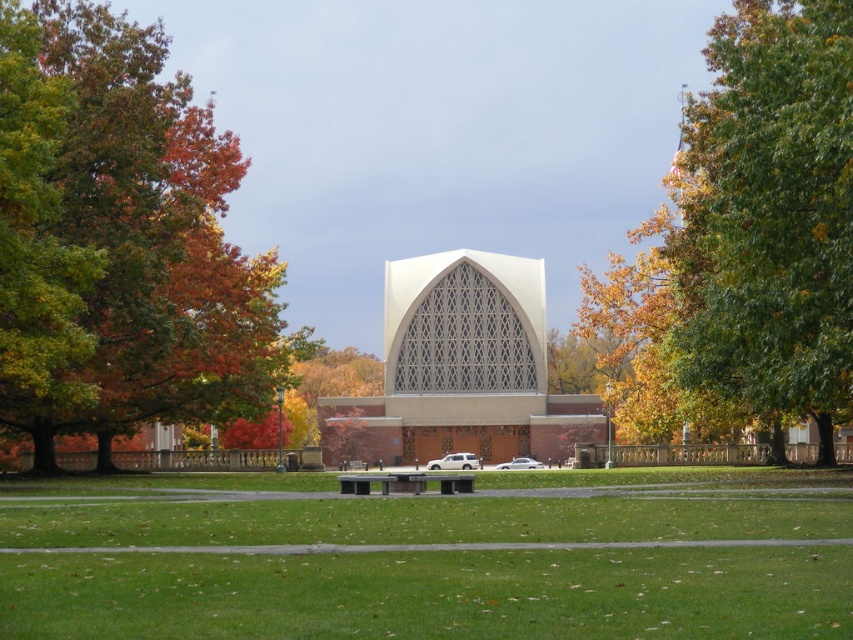
You are standing at the entrance of the building and want to walk to the green grass at center. According to the coordinates provided, in which direction should you move relative to the building?

The green grass at center is located at coordinates point (431, 557). Since the coordinates are given as x,y where higher x values move right and higher y values move up, moving towards the right and slightly upwards from the building would lead you to the green grass at center.

You are standing at the entrance of the building and want to walk towards the point marked as point (636,492). Which direction should you walk relative to the point marked as point (456,454)?

You should walk towards the point (636,492), which is in front of the point (456,454).